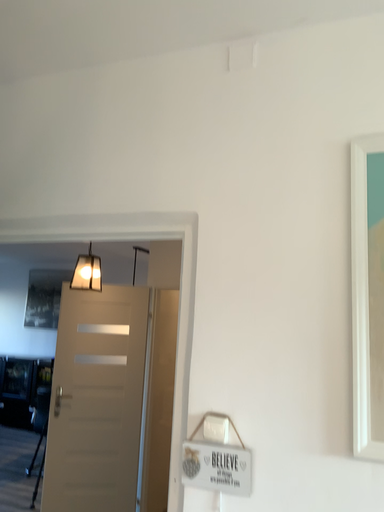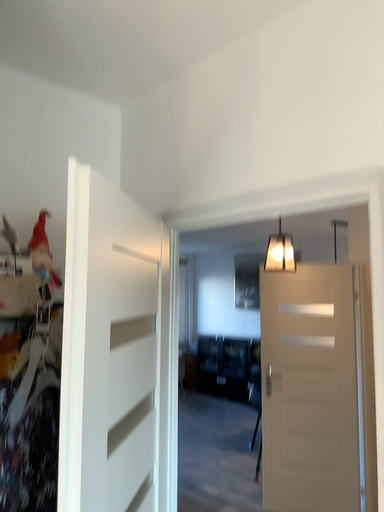
Question: Which way did the camera rotate in the video?

Choices:
 (A) rotated left
 (B) rotated right

Answer: (A)